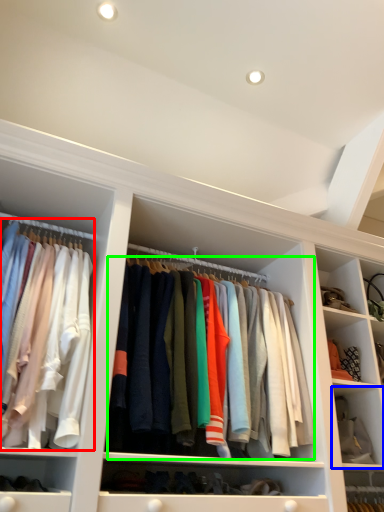
Question: Considering the real-world distances, which object is closest to clothing (highlighted by a red box)? cabinet (highlighted by a blue box) or clothing (highlighted by a green box).

Choices:
 (A) cabinet
 (B) clothing

Answer: (B)